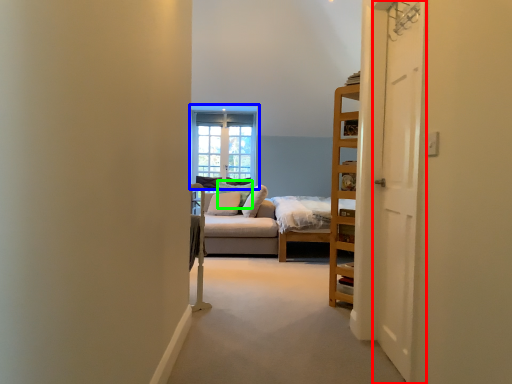
Question: Based on their relative distances, which object is farther from door (highlighted by a red box)? Choose from window (highlighted by a blue box) and pillow (highlighted by a green box).

Choices:
 (A) window
 (B) pillow

Answer: (A)